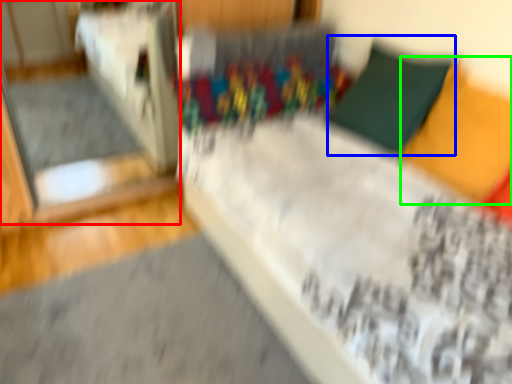
Question: Which is farther away from glass door (highlighted by a red box)? pillow (highlighted by a blue box) or pillow (highlighted by a green box)?

Choices:
 (A) pillow
 (B) pillow

Answer: (B)